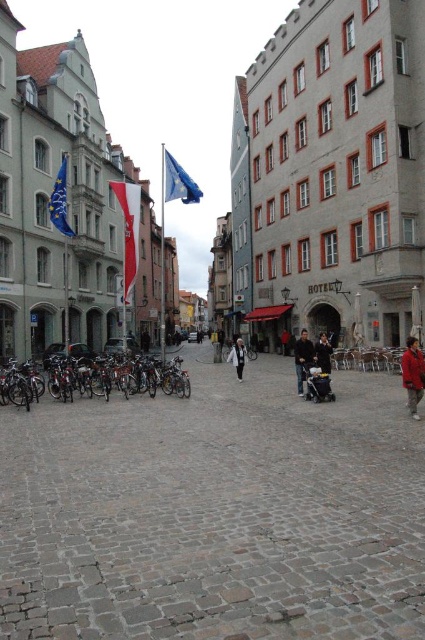
Question: Which is nearer to the white cotton jacket at center?

Choices:
 (A) red jacket at lower right
 (B) blue fabric flag at upper center
 (C) dark gray sweater at center
 (D) blue fabric flag at left

Answer: (C)

Question: Does gray cobblestone square at center have a greater width compared to dark gray sweater at center?

Choices:
 (A) no
 (B) yes

Answer: (B)

Question: Is gray cobblestone square at center to the right of white fabric flag at center from the viewer's perspective?

Choices:
 (A) yes
 (B) no

Answer: (A)

Question: Is white fabric flag at center bigger than dark brown leather jacket at center?

Choices:
 (A) yes
 (B) no

Answer: (A)

Question: Based on their relative distances, which object is nearer to the dark gray sweater at center?

Choices:
 (A) gray cobblestone square at center
 (B) white cotton jacket at center
 (C) white fabric flag at center
 (D) dark brown leather jacket at center

Answer: (D)

Question: Considering the real-world distances, which object is farthest from the white cotton jacket at center?

Choices:
 (A) red jacket at lower right
 (B) dark brown leather jacket at center

Answer: (A)